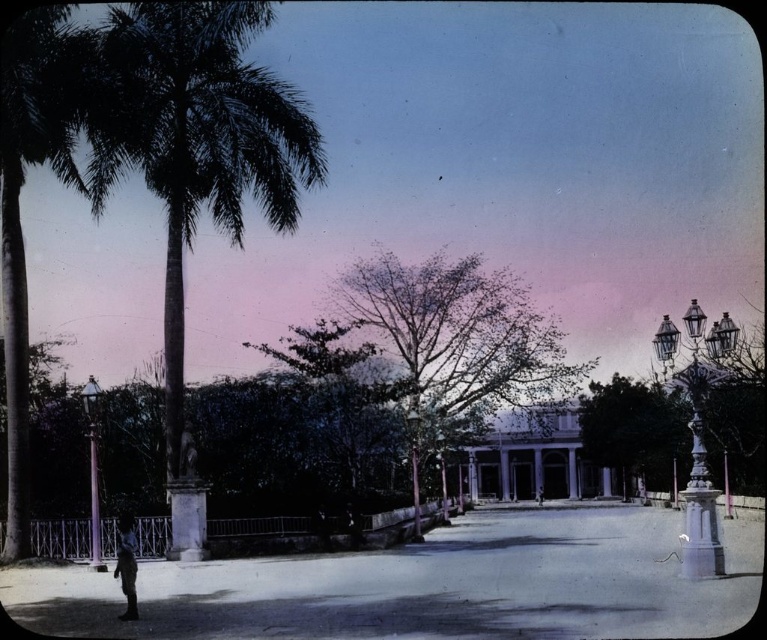
Question: Which is farther from the polished metal lamp post at left?

Choices:
 (A) green leafy palm tree at left
 (B) polished bronze streetlight at right
 (C) polished brass lamp post at center

Answer: (B)

Question: Does green leafy tree at center have a greater width compared to polished metal lamp post at left?

Choices:
 (A) yes
 (B) no

Answer: (A)

Question: Which object is farther from the camera taking this photo?

Choices:
 (A) polished bronze streetlight at right
 (B) dark blue fabric at center

Answer: (A)

Question: Which point is closer to the camera?

Choices:
 (A) pyautogui.click(x=410, y=449)
 (B) pyautogui.click(x=703, y=554)
 (C) pyautogui.click(x=124, y=564)

Answer: (C)

Question: Is green leafy palm tree at left positioned at the back of dark blue fabric at center?

Choices:
 (A) yes
 (B) no

Answer: (A)

Question: Does green leafy palm tree at left have a greater width compared to green leafy tree at center?

Choices:
 (A) yes
 (B) no

Answer: (B)